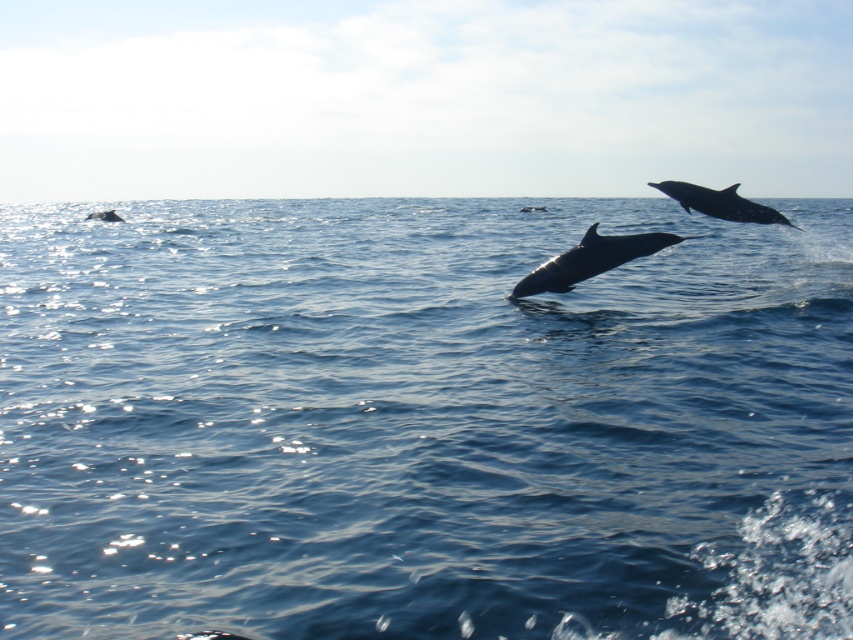
Question: Is silvery skin dolphin at center thinner than smooth gray dolphin at upper right?

Choices:
 (A) yes
 (B) no

Answer: (B)

Question: Which object is closer to the camera taking this photo?

Choices:
 (A) gray matte whale at lower left
 (B) blue water at center

Answer: (B)

Question: From the image, what is the correct spatial relationship of smooth gray dolphin at upper right in relation to gray matte whale at lower left?

Choices:
 (A) left
 (B) right

Answer: (B)

Question: Which point is farther to the camera?

Choices:
 (A) smooth gray dolphin at upper right
 (B) silvery skin dolphin at center
 (C) blue water at center

Answer: (A)

Question: Does silvery skin dolphin at center have a greater width compared to smooth gray dolphin at upper right?

Choices:
 (A) no
 (B) yes

Answer: (B)

Question: Which point is closer to the camera?

Choices:
 (A) smooth gray dolphin at upper right
 (B) silvery skin dolphin at center
 (C) gray matte whale at lower left

Answer: (B)